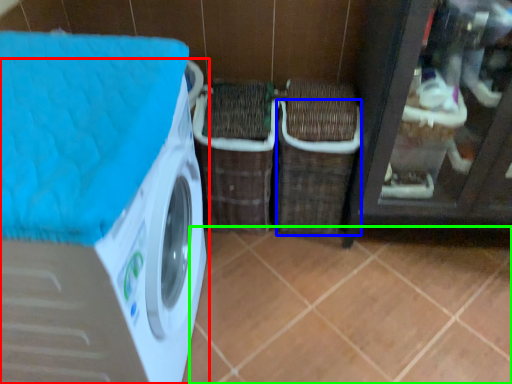
Question: Which object is the farthest from washing machine (highlighted by a red box)? Choose among these: basket (highlighted by a blue box) or tile (highlighted by a green box).

Choices:
 (A) basket
 (B) tile

Answer: (A)